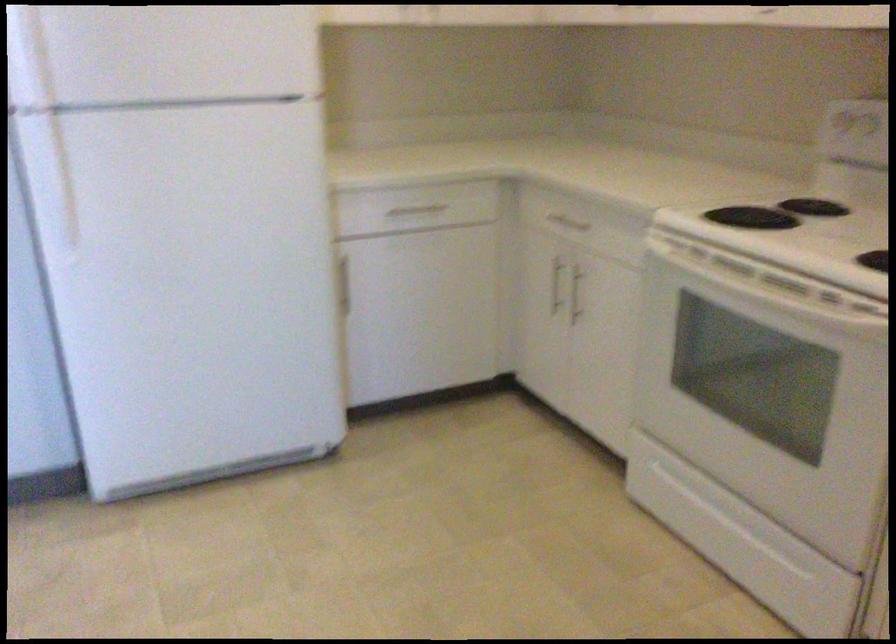
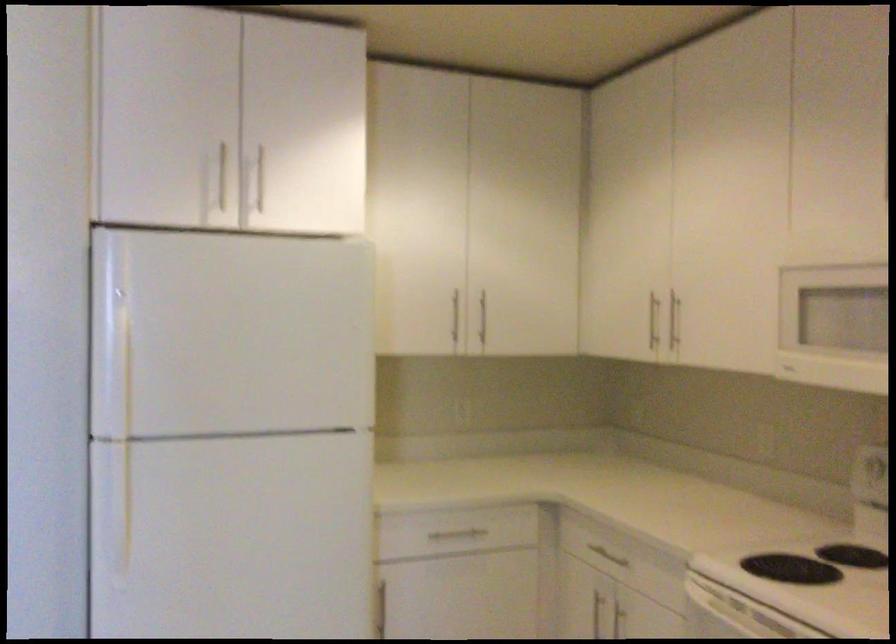
The point at (418, 209) is marked in the first image. Where is the corresponding point in the second image?

(455, 536)